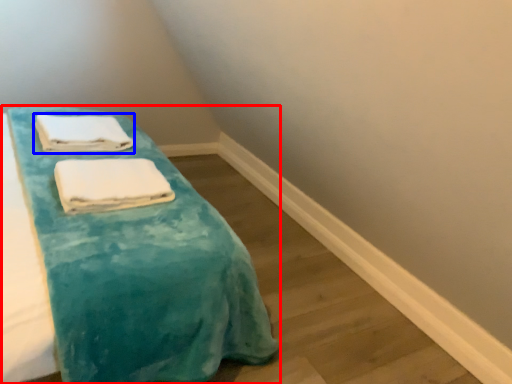
Question: Which object is further to the camera taking this photo, furniture (highlighted by a red box) or towel (highlighted by a blue box)?

Choices:
 (A) furniture
 (B) towel

Answer: (B)